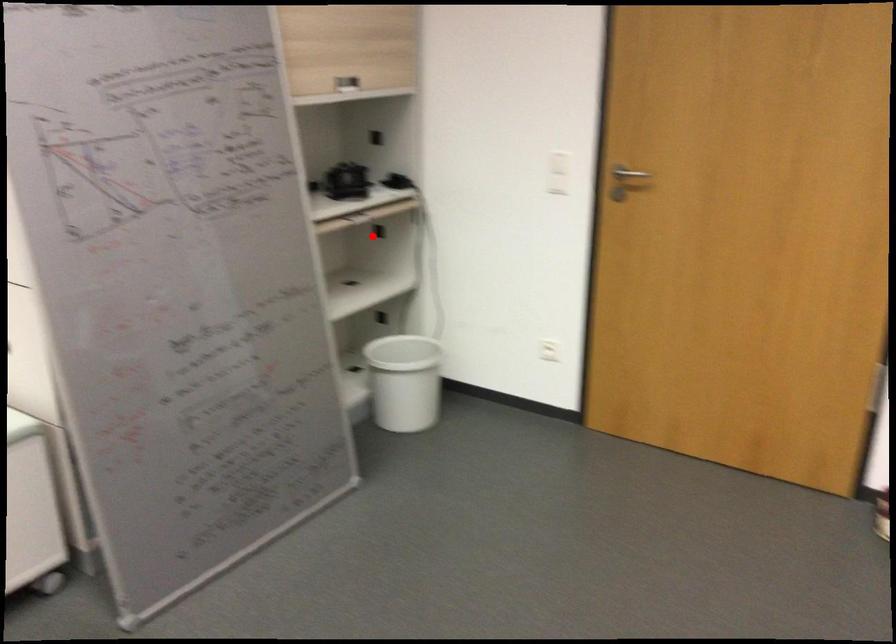
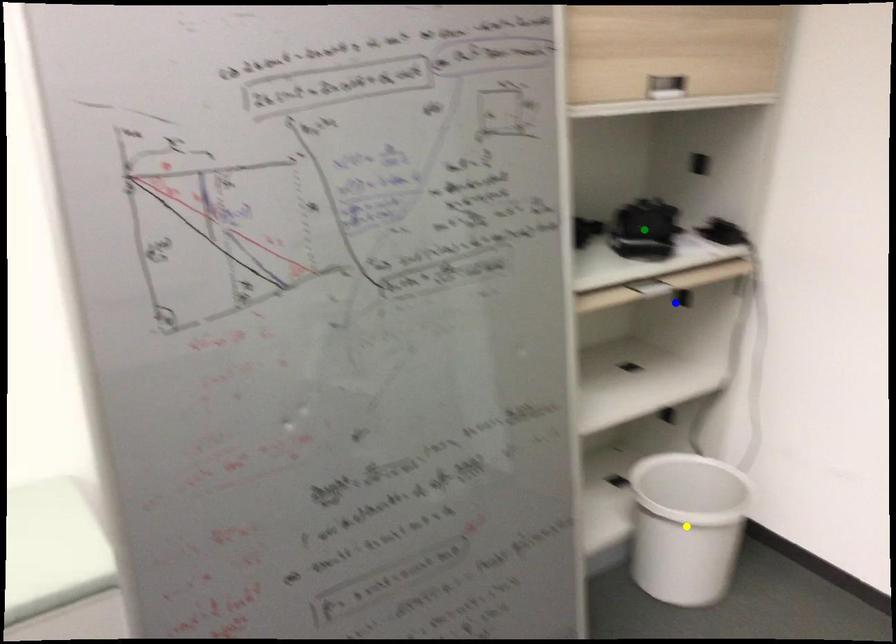
Question: I am providing you with two images of the same scene from different viewpoints. A red point is marked on the first image. You are given multiple points on the second image. Which spot in image 2 lines up with the point in image 1?

Choices:
 (A) blue point
 (B) yellow point
 (C) green point

Answer: (A)